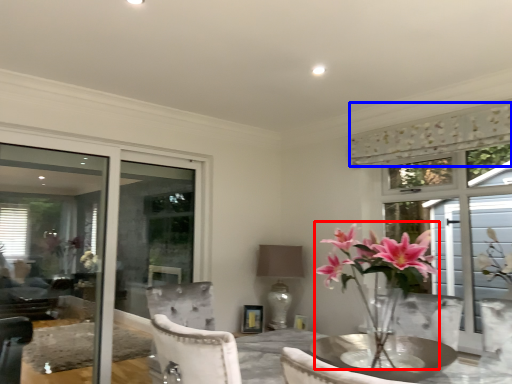
Question: Which point is further to the camera, floral arrangement (highlighted by a red box) or curtain (highlighted by a blue box)?

Choices:
 (A) floral arrangement
 (B) curtain

Answer: (B)